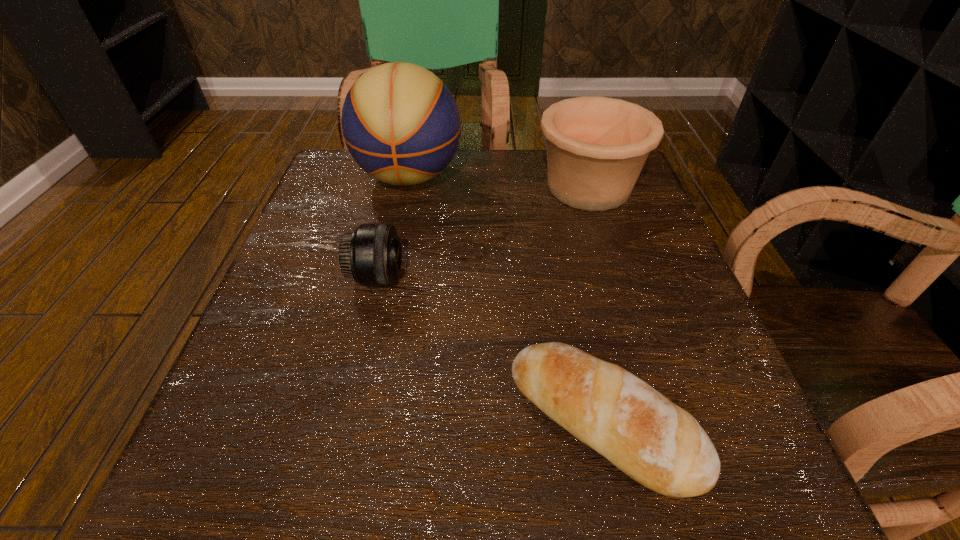
Where is `basketball located in the far edge section of the desktop`? The width and height of the screenshot is (960, 540). basketball located in the far edge section of the desktop is located at coordinates (401, 124).

I want to click on pottery that is at the far edge, so click(596, 146).

Locate an element on the screen. object that is at the near edge is located at coordinates (658, 444).

Identify the location of basketball situated at the left edge. (401, 124).

Find the location of a particular element. telephoto lens located at the left edge is located at coordinates (371, 254).

At what (x,y) coordinates should I click in order to perform the action: click on pottery situated at the right edge. Please return your answer as a coordinate pair (x, y). Image resolution: width=960 pixels, height=540 pixels. Looking at the image, I should click on (596, 146).

Image resolution: width=960 pixels, height=540 pixels. Find the location of `bread that is at the right edge`. bread that is at the right edge is located at coordinates (658, 444).

This screenshot has height=540, width=960. What are the coordinates of `object located in the far left corner section of the desktop` in the screenshot? It's located at (401, 124).

At what (x,y) coordinates should I click in order to perform the action: click on object present at the far right corner. Please return your answer as a coordinate pair (x, y). This screenshot has width=960, height=540. Looking at the image, I should click on (596, 146).

Find the location of a particular element. The width and height of the screenshot is (960, 540). object positioned at the near right corner is located at coordinates (658, 444).